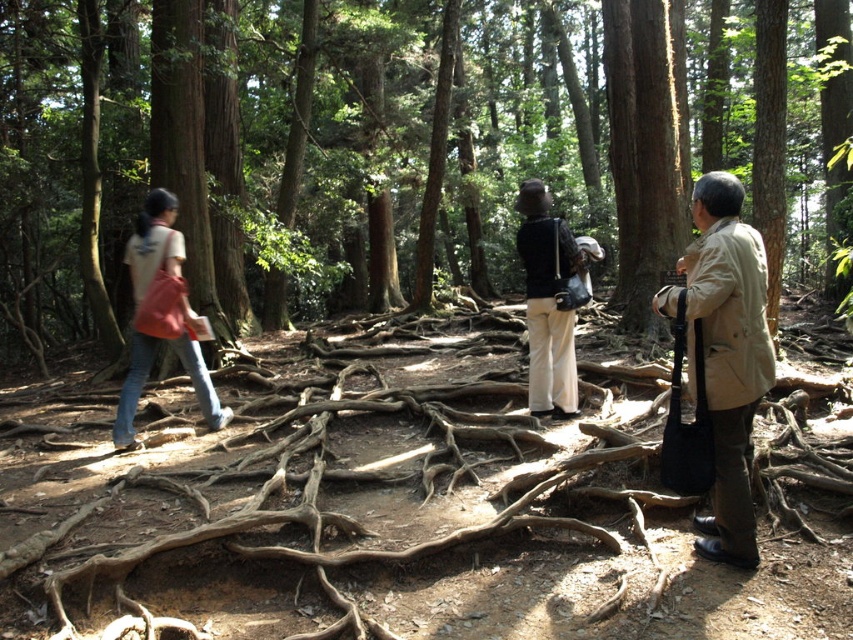
You are standing in the forest and want to take a photo of both point [102,301] and point [521,186] in the scene. Since you can only focus on one point at a time, which point should you choose to ensure both points are in focus?

You should focus on point [521,186] because it is farther from the camera than point [102,301]. By focusing on the farther point, both points will be within the depth of field and in focus.

You are a photographer trying to capture a clear shot of the matte black jacket at center and the denim jeans at left. Since the jacket is covering part of the jeans, which object should you focus on to ensure the jeans are fully visible in your photo?

The matte black jacket at center is positioned over denim jeans at left, so you should move the matte black jacket at center to reveal the denim jeans at left completely.

You are navigating through a forest and need to locate the brown wood tree at center. Based on the exposed tree roots in the foreground, which direction should you move to reach it?

The brown wood tree at center is located at point (273, 156), so you should move towards the center of the forest where the tree roots form a network leading to that location.